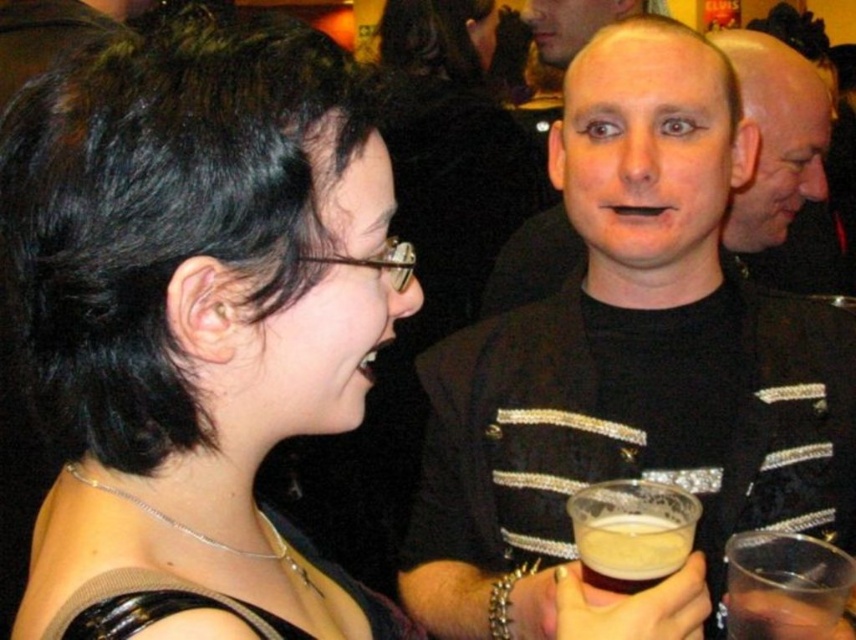
Looking at this image, you are a photographer at the party trying to capture a candid shot of both the smooth bald head at upper right and the translucent plastic cup at lower right. Given their sizes, which object should you focus on first to ensure it fits entirely within your camera frame?

The smooth bald head at upper right is larger in size than the translucent plastic cup at lower right, so you should focus on capturing the smooth bald head at upper right first to ensure it fits within the frame before adjusting for the smaller cup.

In the image provided, there is a point labeled at coordinates (780,157). Based on the scene description, what object or feature does this point most likely represent?

The point at coordinates (780,157) corresponds to the smooth bald head at upper right.

You are organizing a coat rack for a party and need to hang the black textured jacket at center and the translucent plastic cup at lower right. Since the coat rack has limited space, can you determine which item requires more space based on their sizes?

The black textured jacket at center has a larger size compared to the translucent plastic cup at lower right, so it requires more space on the coat rack.